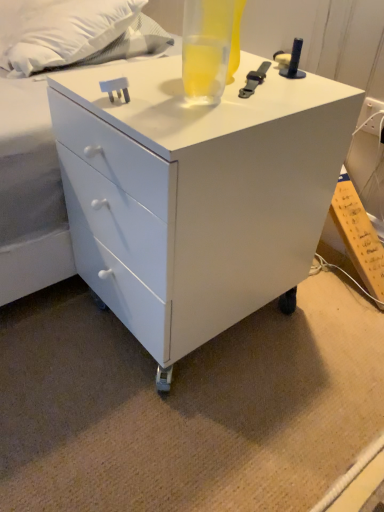
The width and height of the screenshot is (384, 512). What are the coordinates of `free space to the left of translucent glass beverage at top` in the screenshot? It's located at (141, 82).